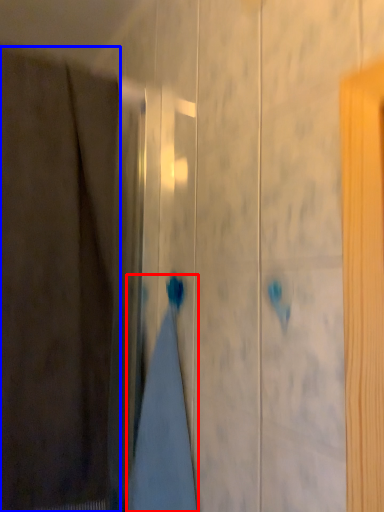
Question: Among these objects, which one is farthest to the camera, bath towel (highlighted by a red box) or curtain (highlighted by a blue box)?

Choices:
 (A) bath towel
 (B) curtain

Answer: (A)